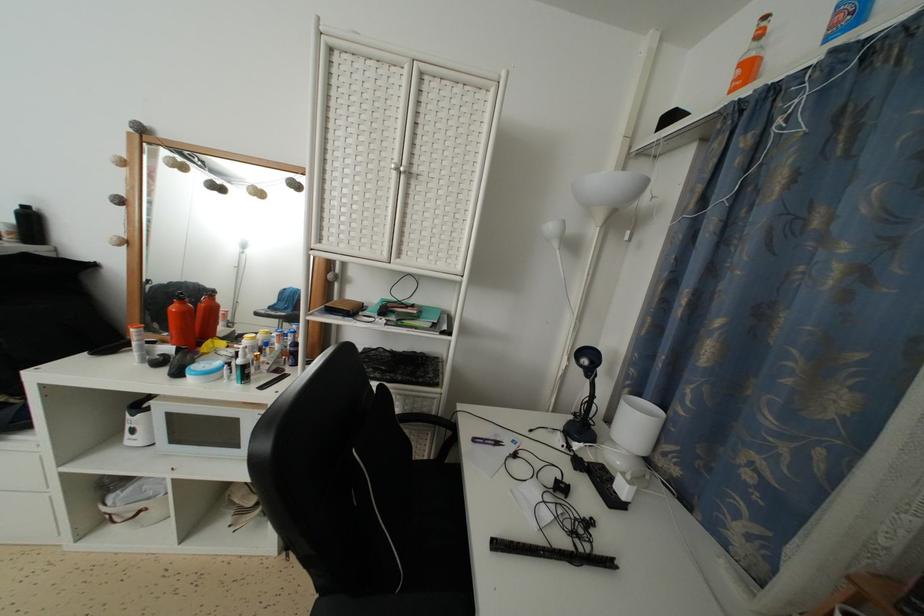
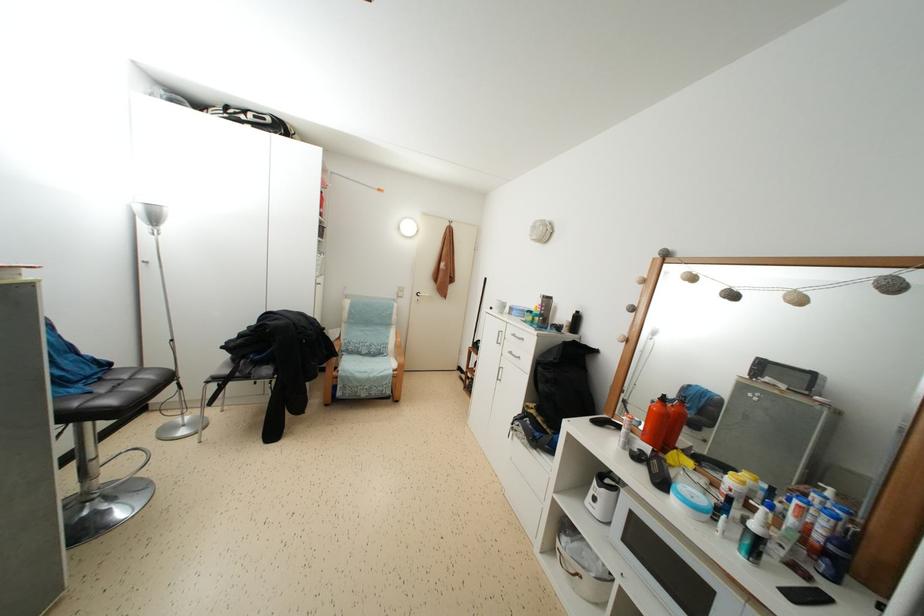
Find the pixel in the second image that matches (x=106, y=493) in the first image.

(566, 532)